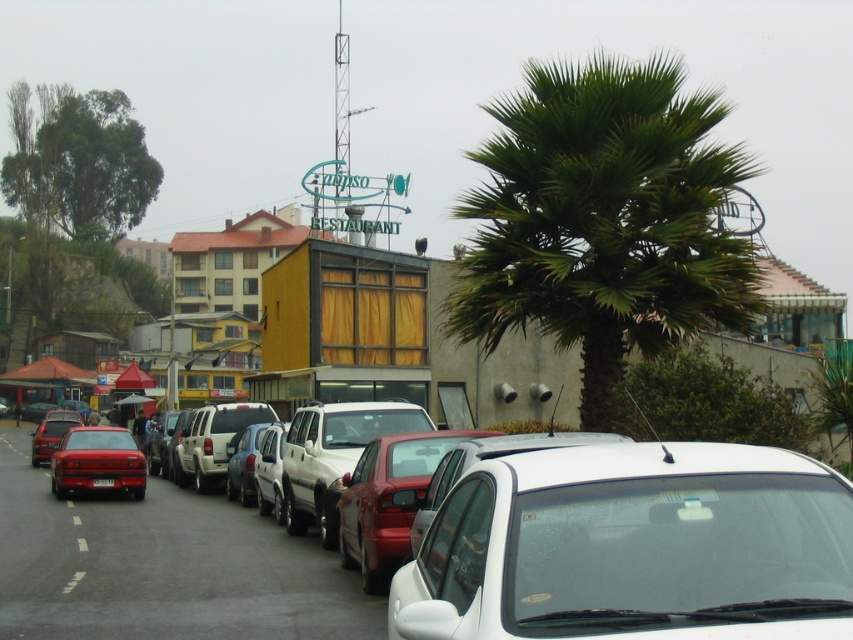
Is green leafy palm tree at center above white dotted line at lower left?

Correct, green leafy palm tree at center is located above white dotted line at lower left.

Is green leafy palm tree at center wider than white dotted line at lower left?

Yes, green leafy palm tree at center is wider than white dotted line at lower left.

This screenshot has width=853, height=640. I want to click on green leafy palm tree at center, so click(x=602, y=220).

Is green leafy palm tree at center thinner than matte red car at center?

Yes, green leafy palm tree at center is thinner than matte red car at center.

Measure the distance between green leafy palm tree at center and camera.

green leafy palm tree at center is 56.31 feet from camera.

Which is in front, point (701, 128) or point (192, 621)?

Point (192, 621) is more forward.

This screenshot has height=640, width=853. What are the coordinates of `green leafy palm tree at center` in the screenshot? It's located at (602, 220).

Can you confirm if white glossy car at center is thinner than white dotted line at lower left?

Yes.

Is white glossy car at center taller than white dotted line at lower left?

Yes, white glossy car at center is taller than white dotted line at lower left.

This screenshot has height=640, width=853. What are the coordinates of `white glossy car at center` in the screenshot? It's located at (634, 547).

Locate an element on the screen. white glossy car at center is located at coordinates (634, 547).